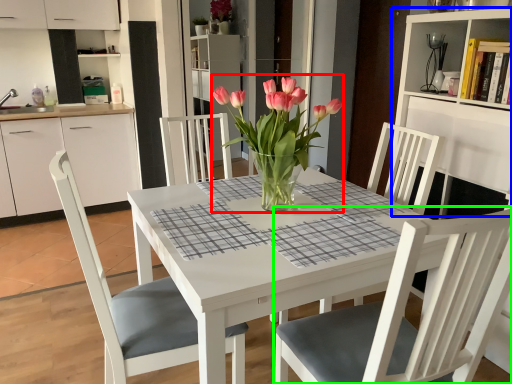
Question: Considering the real-world distances, which object is closest to floral arrangement (highlighted by a red box)? bookshelf (highlighted by a blue box) or chair (highlighted by a green box).

Choices:
 (A) bookshelf
 (B) chair

Answer: (B)